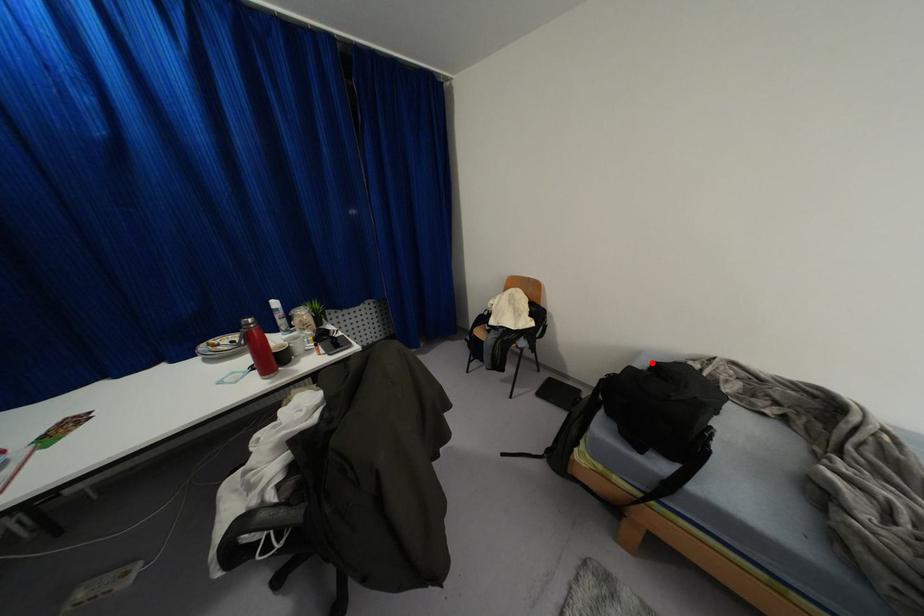
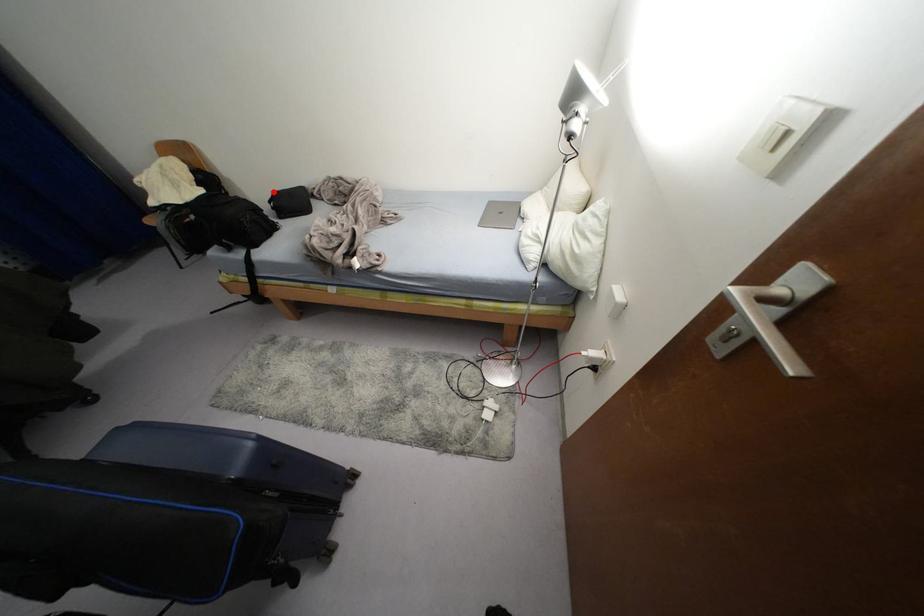
I am providing you with two images of the same scene from different viewpoints. A red point is marked on the first image and another point is marked on the second image. Do the highlighted points in image1 and image2 indicate the same real-world spot?

Yes